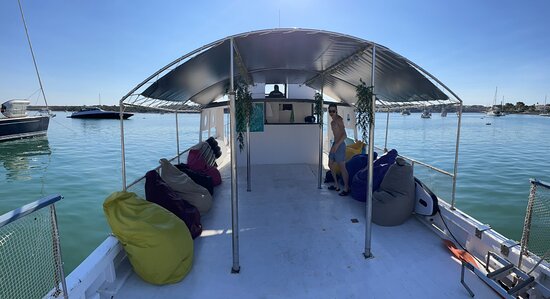
Identify the location of cover. (304, 43).